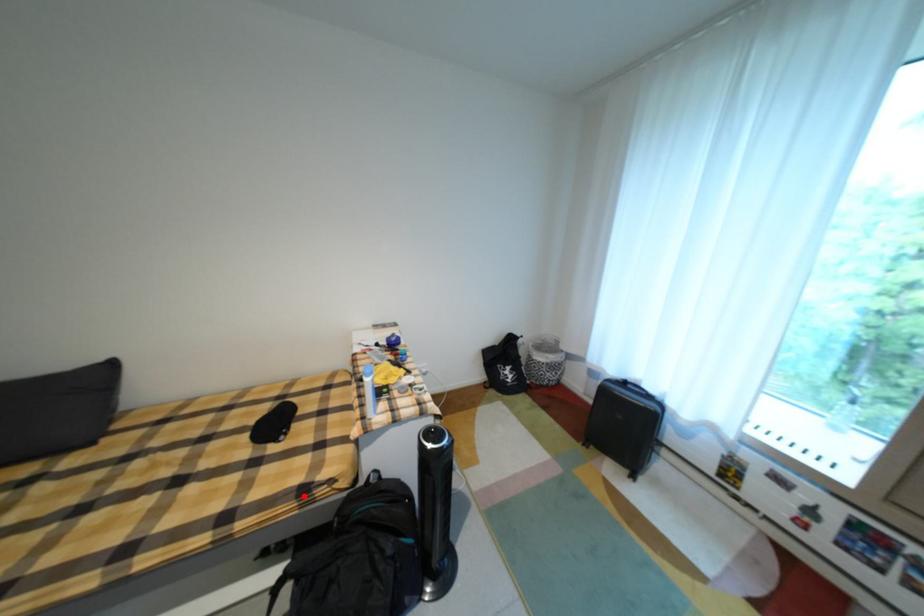
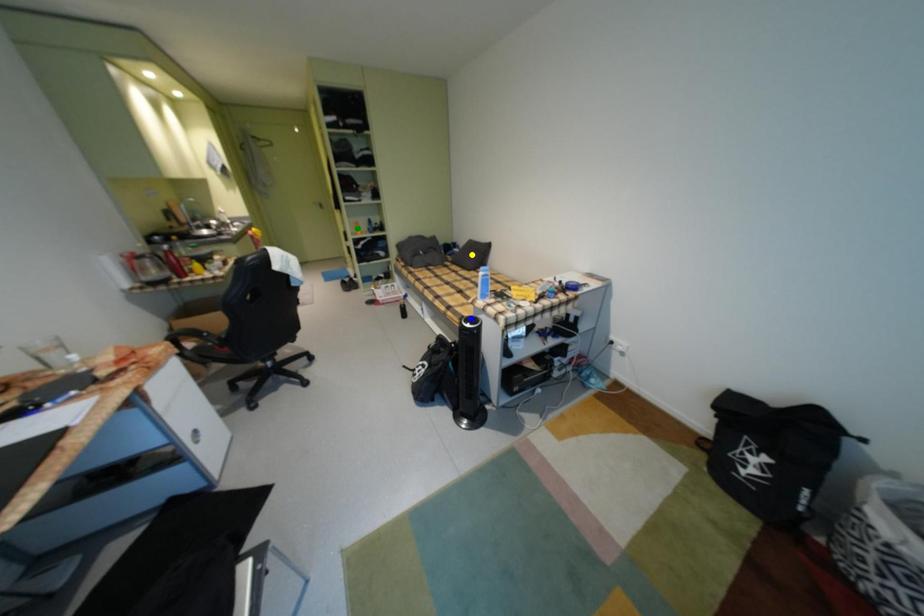
Question: I am providing you with two images of the same scene from different viewpoints. A red point is marked on the first image. You are given multiple points on the second image. Which spot in image 2 lines up with the point in image 1?

Choices:
 (A) yellow point
 (B) green point
 (C) blue point

Answer: (C)